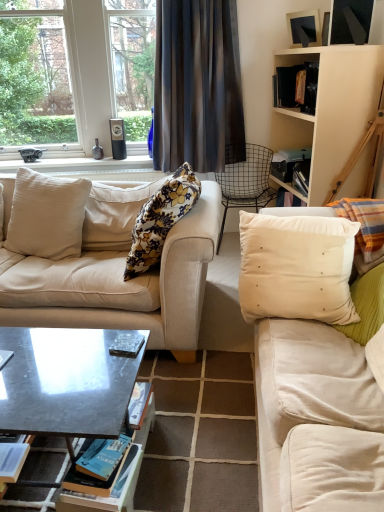
Find the location of `empty space that is ontop of hardcover book at center, the 2th book when ordered from right to left (from a real-world perspective)`. empty space that is ontop of hardcover book at center, the 2th book when ordered from right to left (from a real-world perspective) is located at coordinates (105, 446).